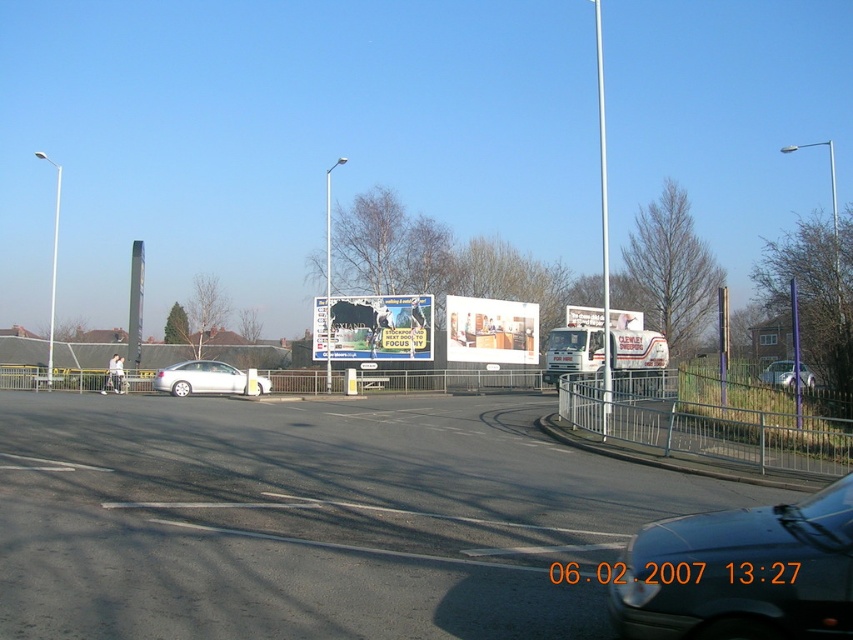
Question: Observing the image, what is the correct spatial positioning of metallic billboard at center in reference to satin silver sedan at center?

Choices:
 (A) above
 (B) below

Answer: (A)

Question: Which object appears farthest from the camera in this image?

Choices:
 (A) black asphalt road at center
 (B) shiny black car at lower right
 (C) matte white billboard at center
 (D) satin silver sedan at center

Answer: (C)

Question: Among these objects, which one is nearest to the camera?

Choices:
 (A) matte white billboard at center
 (B) shiny black car at lower right

Answer: (B)

Question: Among these points, which one is nearest to the camera?

Choices:
 (A) (381, 304)
 (B) (811, 384)
 (C) (498, 547)
 (D) (634, 317)

Answer: (C)

Question: Does white glossy kitchen at center appear on the right side of matte white billboard at center?

Choices:
 (A) yes
 (B) no

Answer: (B)

Question: Does satin silver sedan at center have a greater width compared to silver metallic sedan at center?

Choices:
 (A) no
 (B) yes

Answer: (B)